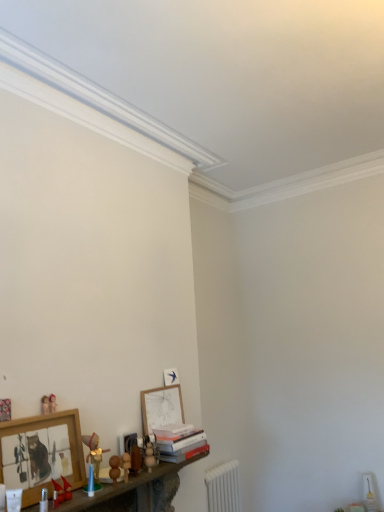
Locate an element on the screen. This screenshot has height=512, width=384. empty space that is ontop of wooden at lower left (from a real-world perspective) is located at coordinates (113, 476).